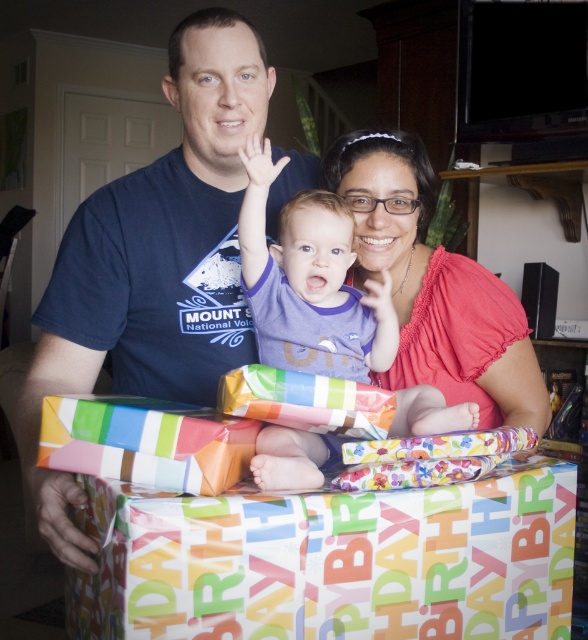
The height and width of the screenshot is (640, 588). In order to click on matte pink blouse at center in this screenshot , I will do `click(433, 285)`.

Between matte pink blouse at center and multicolored paper wrapped gift at lower center, which one is positioned lower?

multicolored paper wrapped gift at lower center

This screenshot has height=640, width=588. Find the location of `matte pink blouse at center`. matte pink blouse at center is located at coordinates (433, 285).

Does point (192, 342) come farther from viewer compared to point (330, 289)?

Yes, it is.

Between point (196, 308) and point (342, 264), which one is positioned behind?

Positioned behind is point (196, 308).

Identify the location of matte blue t-shirt at center. (151, 266).

In the scene shown: Does multicolored paper gift at center appear on the right side of multicolored paper wrapped gift at lower center?

Correct, you'll find multicolored paper gift at center to the right of multicolored paper wrapped gift at lower center.

Based on the photo, can you confirm if multicolored paper gift at center is smaller than multicolored paper wrapped gift at lower center?

No, multicolored paper gift at center is not smaller than multicolored paper wrapped gift at lower center.

The height and width of the screenshot is (640, 588). What do you see at coordinates (332, 561) in the screenshot?
I see `multicolored paper gift at center` at bounding box center [332, 561].

You are a GUI agent. You are given a task and a screenshot of the screen. Output one action in this format:
    pyautogui.click(x=<x>, y=<y>)
    Task: Click on the multicolored paper gift at center
    This screenshot has width=588, height=640.
    Given the screenshot: What is the action you would take?
    pyautogui.click(x=332, y=561)